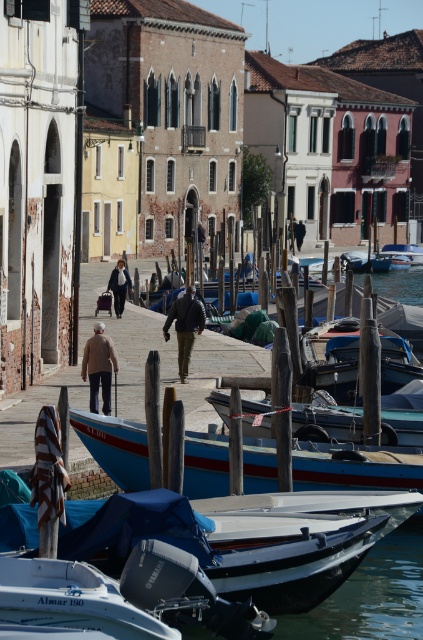
Measure the distance between point [32,524] and camera.

The distance of point [32,524] from camera is 24.98 meters.

Is blue tarpaulin boat at lower center closer to the viewer compared to blue painted wooden boat at lower center?

Yes, it is.

The height and width of the screenshot is (640, 423). In order to click on blue tarpaulin boat at lower center in this screenshot , I will do `click(225, 547)`.

I want to click on blue tarpaulin boat at lower center, so click(225, 547).

Is blue painted wooden boat at lower center thinner than dark brown leather jacket at center?

Indeed, blue painted wooden boat at lower center has a lesser width compared to dark brown leather jacket at center.

Does blue painted wooden boat at lower center have a larger size compared to dark brown leather jacket at center?

No.

The width and height of the screenshot is (423, 640). I want to click on blue painted wooden boat at lower center, so click(353, 468).

The width and height of the screenshot is (423, 640). Identify the location of blue painted wooden boat at lower center. (353, 468).

Does teal matte boat at center lie in front of blue wooden boat at center?

Yes.

Is point (417, 419) less distant than point (422, 262)?

Yes, it is.

This screenshot has height=640, width=423. I want to click on teal matte boat at center, so click(x=326, y=422).